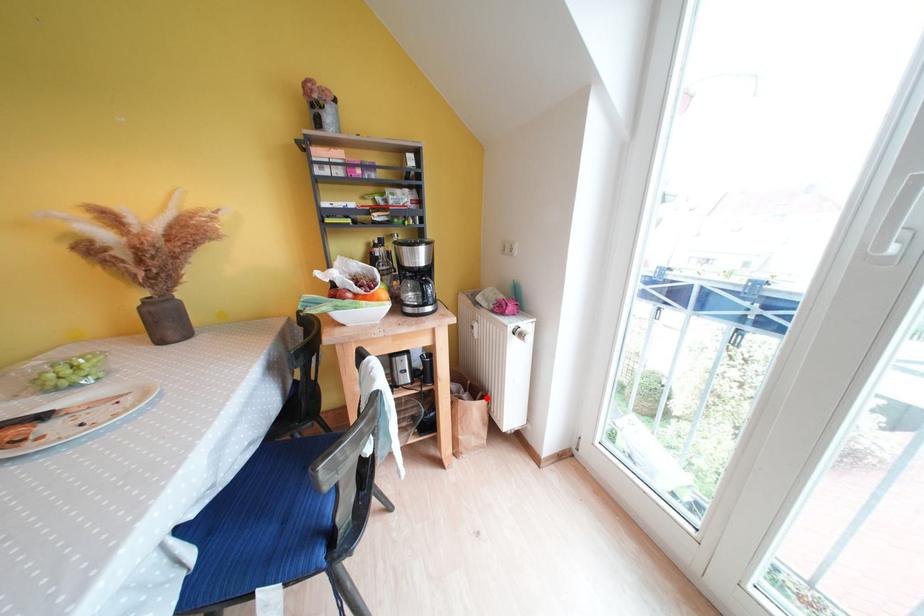
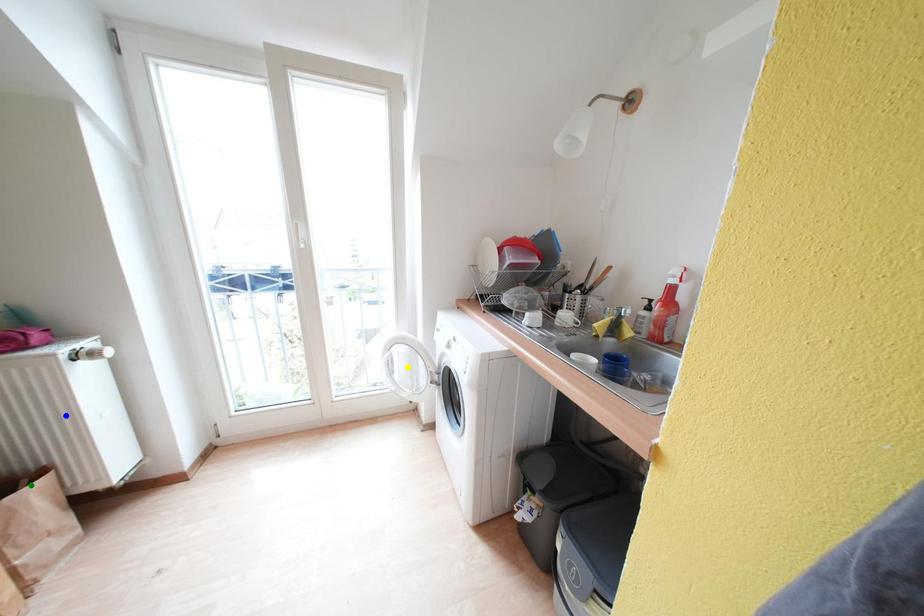
Question: I am providing you with two images of the same scene from different viewpoints. A red point is marked on the first image. You are given multiple points on the second image. Can you choose the point in image 2 that corresponds to the point in image 1?

Choices:
 (A) blue point
 (B) green point
 (C) yellow point

Answer: (B)